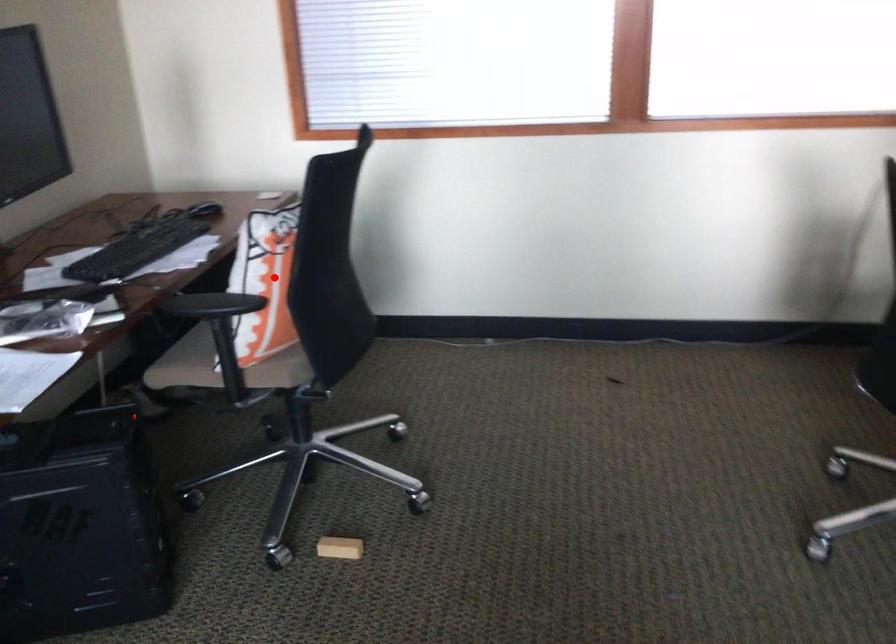
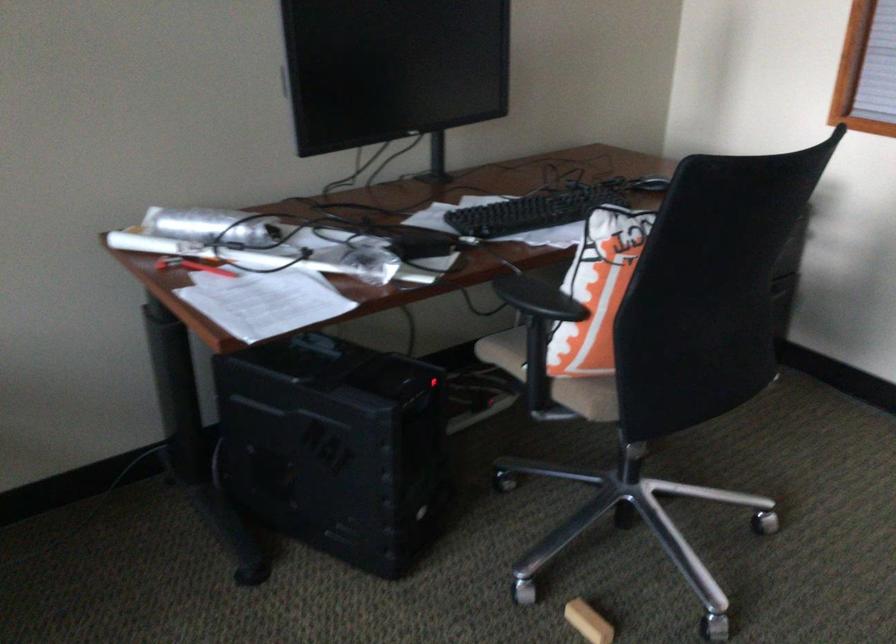
Question: A red point is marked in image1. In image2, is the corresponding 3D point closer to the camera or farther? Reply with the corresponding letter.

Choices:
 (A) The corresponding 3D point is closer.
 (B) The corresponding 3D point is farther.

Answer: (A)